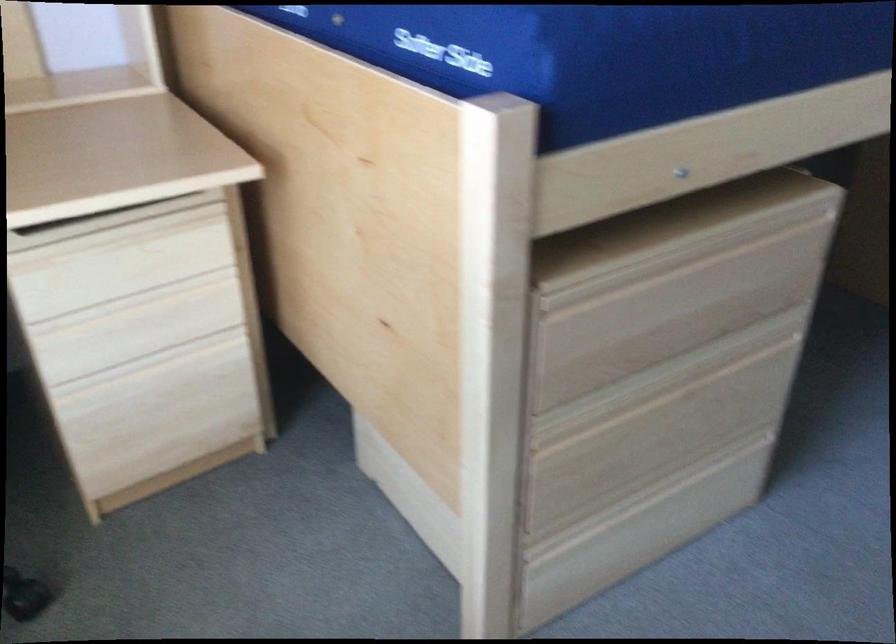
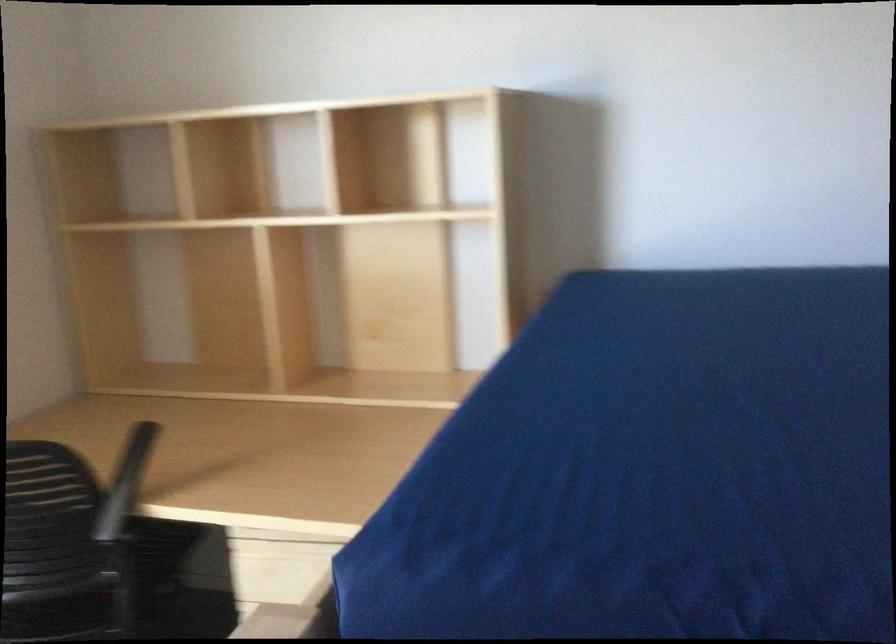
Question: The images are taken continuously from a first-person perspective. In which direction is your viewpoint rotating?

Choices:
 (A) Left
 (B) Right
 (C) Up
 (D) Down

Answer: (A)